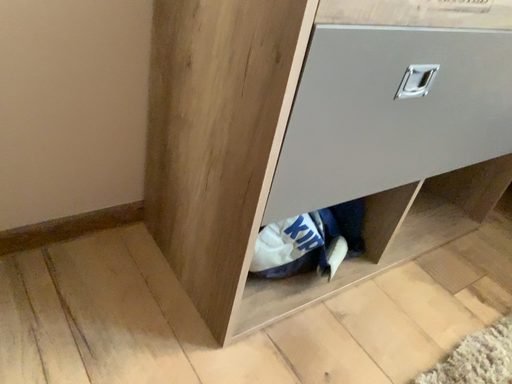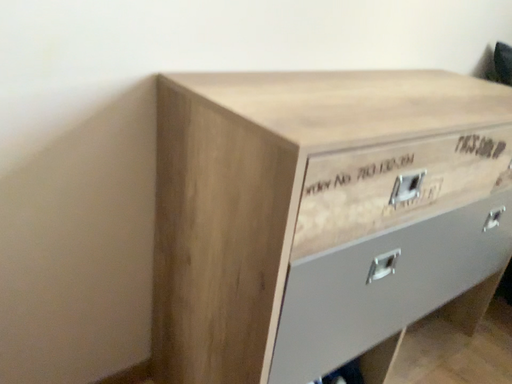
Question: Which way did the camera rotate in the video?

Choices:
 (A) rotated downward
 (B) rotated upward

Answer: (B)